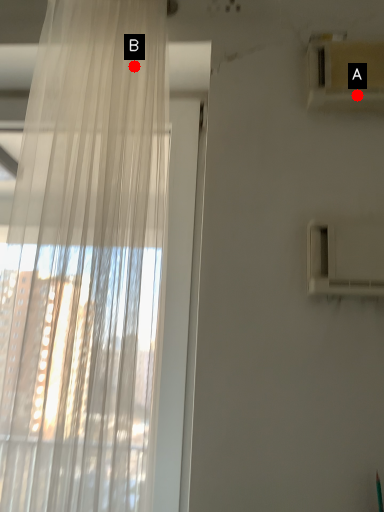
Question: Two points are circled on the image, labeled by A and B beside each circle. Which point is farther to the camera?

Choices:
 (A) A is further
 (B) B is further

Answer: (A)